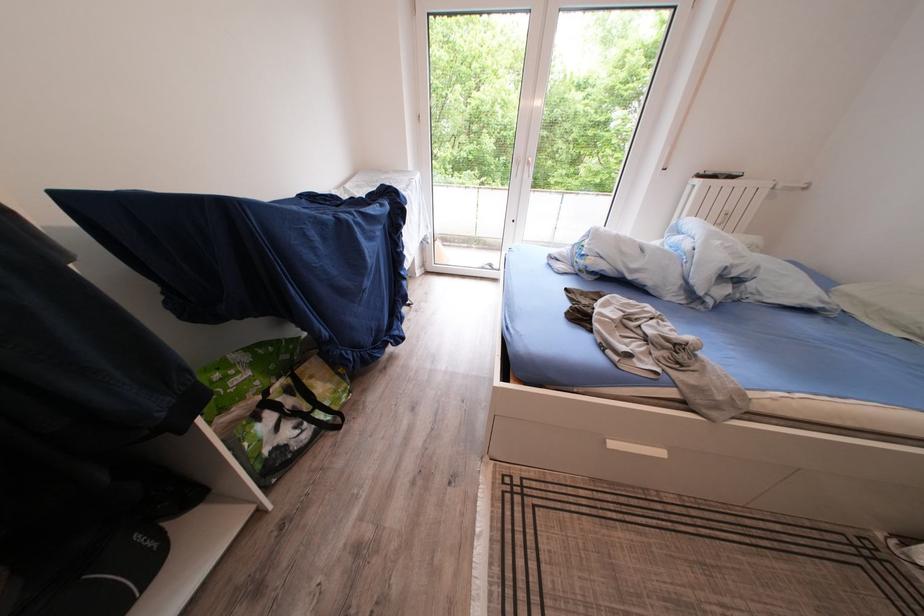
This screenshot has width=924, height=616. What do you see at coordinates (637, 448) in the screenshot?
I see `the white drawer handle` at bounding box center [637, 448].